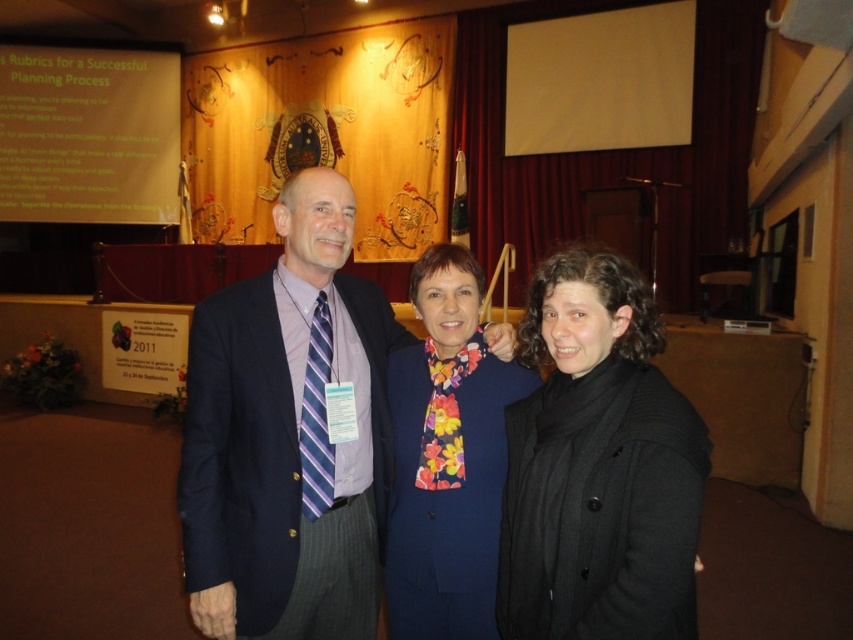
Question: Considering the relative positions of black wool coat at center and white matte projection screen at upper center in the image provided, where is black wool coat at center located with respect to white matte projection screen at upper center?

Choices:
 (A) right
 (B) left

Answer: (B)

Question: Which object is closer to the camera taking this photo?

Choices:
 (A) black wool coat at center
 (B) white matte projection screen at upper center
 (C) dark blue suit at center
 (D) white paper at upper left

Answer: (A)

Question: Which point appears farthest from the camera in this image?

Choices:
 (A) (381, 461)
 (B) (407, 371)
 (C) (624, 634)

Answer: (B)

Question: Does dark blue suit at center come behind white paper at upper left?

Choices:
 (A) no
 (B) yes

Answer: (A)

Question: In this image, where is floral scarf at center located relative to white matte projection screen at upper center?

Choices:
 (A) left
 (B) right

Answer: (A)

Question: Considering the real-world distances, which object is closest to the dark blue suit at center?

Choices:
 (A) black wool coat at center
 (B) white paper at upper left
 (C) floral scarf at center

Answer: (C)